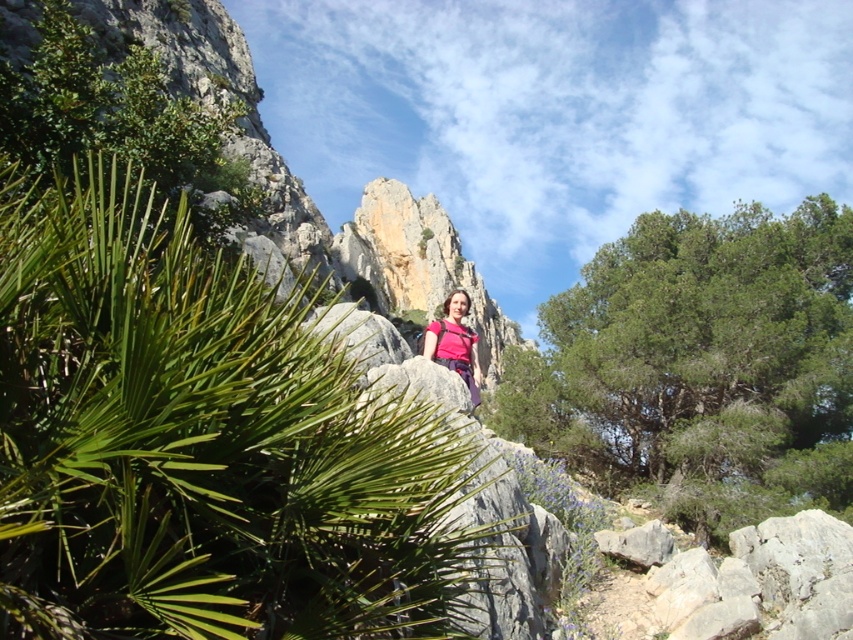
Between green leafy plant at center and green leafy tree at center, which one has less height?

green leafy plant at center is shorter.

Is green leafy plant at center below green leafy tree at center?

Actually, green leafy plant at center is above green leafy tree at center.

Is point (123, 403) positioned behind point (694, 436)?

No, it is not.

What are the coordinates of `green leafy plant at center` in the screenshot? It's located at (204, 444).

From the picture: Is green leafy tree at center smaller than pink fabric at center?

No, green leafy tree at center is not smaller than pink fabric at center.

Between green leafy tree at center and pink fabric at center, which one is positioned lower?

green leafy tree at center

Is point (677, 433) closer to viewer compared to point (479, 390)?

No, it is behind (479, 390).

Where is `green leafy tree at center`? This screenshot has width=853, height=640. green leafy tree at center is located at coordinates (701, 365).

Can you confirm if green leafy plant at center is smaller than pink fabric at center?

Incorrect, green leafy plant at center is not smaller in size than pink fabric at center.

Which is below, green leafy plant at center or pink fabric at center?

green leafy plant at center is lower down.

Is point (33, 378) positioned after point (465, 292)?

No, it is in front of (465, 292).

This screenshot has width=853, height=640. Identify the location of green leafy plant at center. (204, 444).